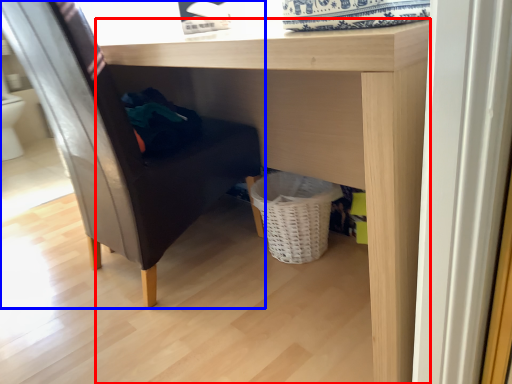
Question: Which object appears closest to the camera in this image, table (highlighted by a red box) or furniture (highlighted by a blue box)?

Choices:
 (A) table
 (B) furniture

Answer: (A)